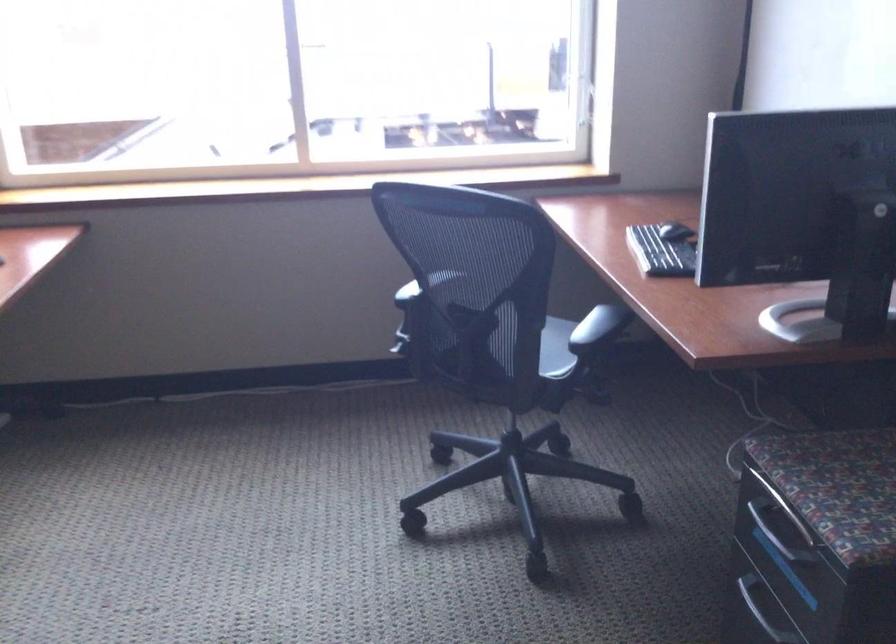
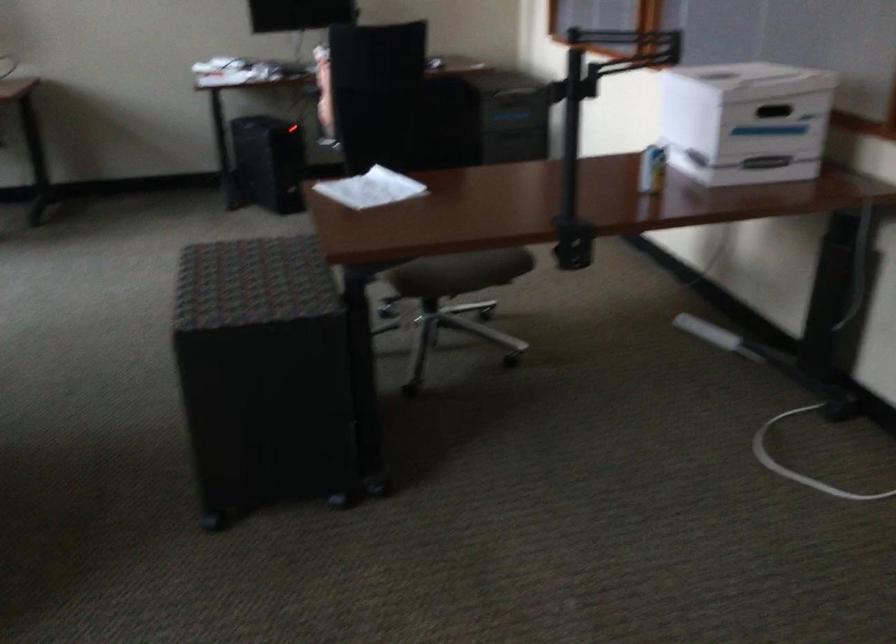
The first image is from the beginning of the video and the second image is from the end. How did the camera likely rotate when shooting the video?

The rotation direction of the camera is right-down.